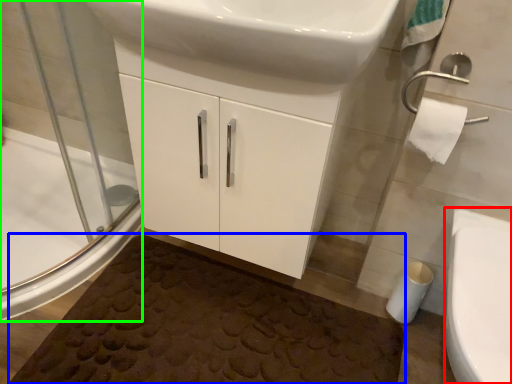
Question: Which object is the closest to the bidet (highlighted by a red box)? Choose among these: bath mat (highlighted by a blue box) or shower door (highlighted by a green box).

Choices:
 (A) bath mat
 (B) shower door

Answer: (A)